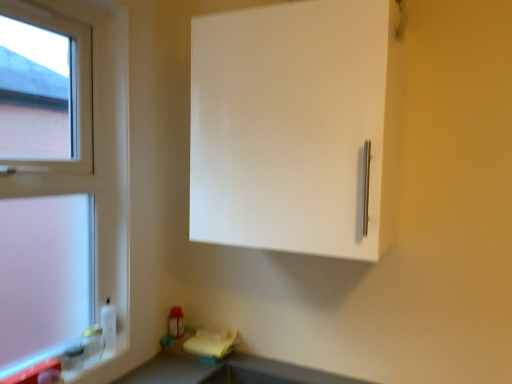
Question: From the image's perspective, is white matte cabinet at upper right above or below white plastic window at left?

Choices:
 (A) below
 (B) above

Answer: (B)

Question: Relative to white plastic window at left, is white matte cabinet at upper right in front or behind?

Choices:
 (A) front
 (B) behind

Answer: (A)

Question: Which is nearer to the white matte cabinet at upper right?

Choices:
 (A) white plastic window at left
 (B) smooth gray countertop at lower center

Answer: (A)

Question: Which object is positioned farthest from the smooth gray countertop at lower center?

Choices:
 (A) white matte cabinet at upper right
 (B) white plastic window at left

Answer: (A)